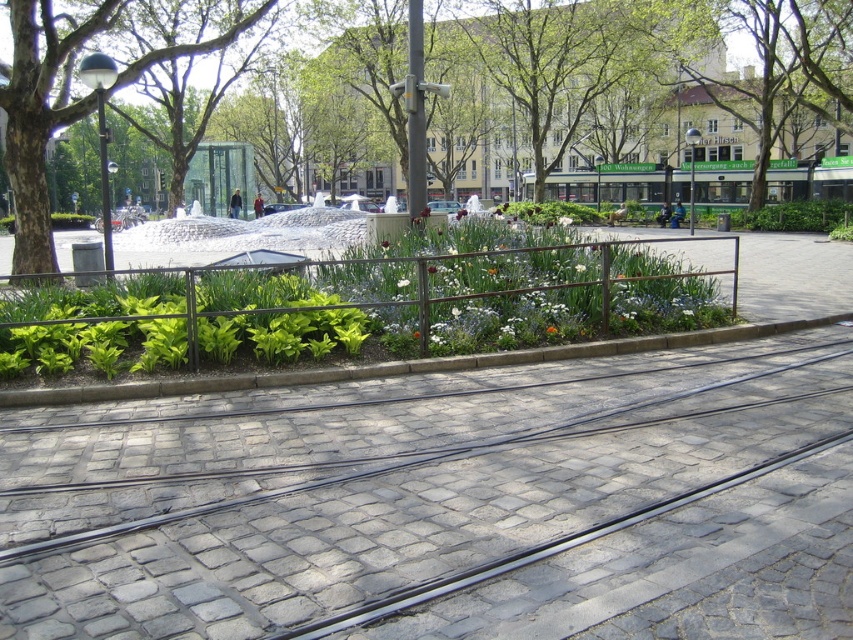
Who is more forward, (590, 76) or (695, 77)?

Point (695, 77) is more forward.

Which is above, green leafy tree at center or green leafy tree at upper center?

green leafy tree at upper center is higher up.

Image resolution: width=853 pixels, height=640 pixels. What do you see at coordinates (546, 76) in the screenshot? I see `green leafy tree at center` at bounding box center [546, 76].

Image resolution: width=853 pixels, height=640 pixels. In order to click on green leafy tree at center in this screenshot , I will do `click(546, 76)`.

Does gray cobblestone train track at center have a larger size compared to green leafy tree at upper center?

No.

Can you confirm if gray cobblestone train track at center is positioned below green leafy tree at upper center?

Indeed, gray cobblestone train track at center is positioned under green leafy tree at upper center.

Where is `gray cobblestone train track at center`? Image resolution: width=853 pixels, height=640 pixels. gray cobblestone train track at center is located at coordinates (374, 481).

Can you confirm if green leafy tree at left is positioned to the left of green leafy tree at upper center?

Indeed, green leafy tree at left is positioned on the left side of green leafy tree at upper center.

Identify the location of green leafy tree at left. (41, 115).

Who is more distant from viewer, (10, 141) or (758, 106)?

Positioned behind is point (758, 106).

Find the location of `green leafy tree at left`. green leafy tree at left is located at coordinates (41, 115).